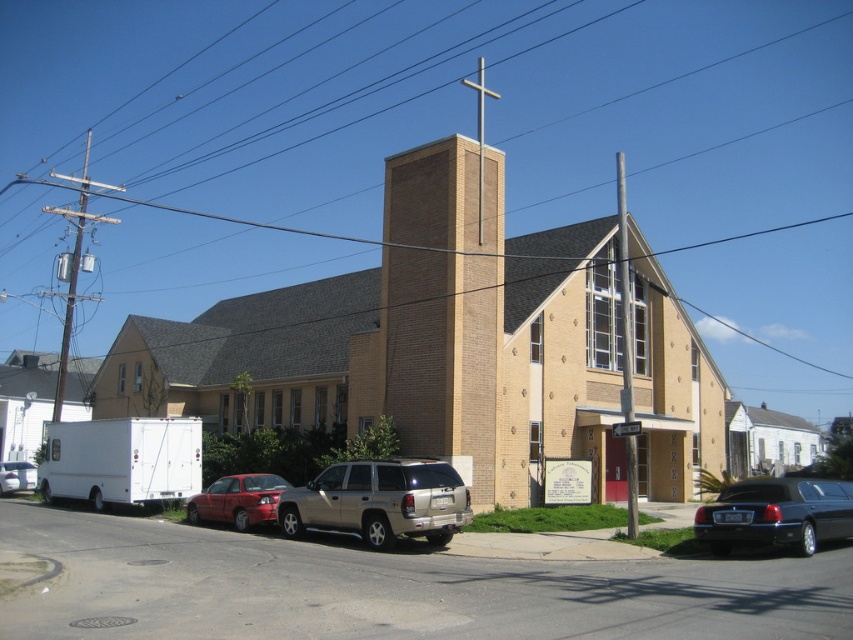
Is shiny black limousine at lower right to the left of shiny red sedan at lower left from the viewer's perspective?

In fact, shiny black limousine at lower right is to the right of shiny red sedan at lower left.

Between shiny black limousine at lower right and shiny red sedan at lower left, which one appears on the right side from the viewer's perspective?

shiny black limousine at lower right

Locate an element on the screen. This screenshot has height=640, width=853. shiny black limousine at lower right is located at coordinates (776, 515).

Find the location of a particular element. This screenshot has height=640, width=853. shiny black limousine at lower right is located at coordinates (776, 515).

Does point (538, 465) come farther from viewer compared to point (730, 518)?

Yes, point (538, 465) is behind point (730, 518).

Which is above, brown brick church at center or shiny black limousine at lower right?

brown brick church at center

Between point (653, 483) and point (799, 509), which one is positioned in front?

Point (799, 509)

Where is `brown brick church at center`? This screenshot has height=640, width=853. brown brick church at center is located at coordinates (415, 339).

Is silver metallic suv at center positioned in front of shiny black limousine at lower right?

No, silver metallic suv at center is further to the viewer.

Who is taller, silver metallic suv at center or shiny black limousine at lower right?

shiny black limousine at lower right

Is point (380, 502) farther from viewer compared to point (770, 492)?

Yes, it is.

The width and height of the screenshot is (853, 640). In order to click on silver metallic suv at center in this screenshot , I will do `click(379, 500)`.